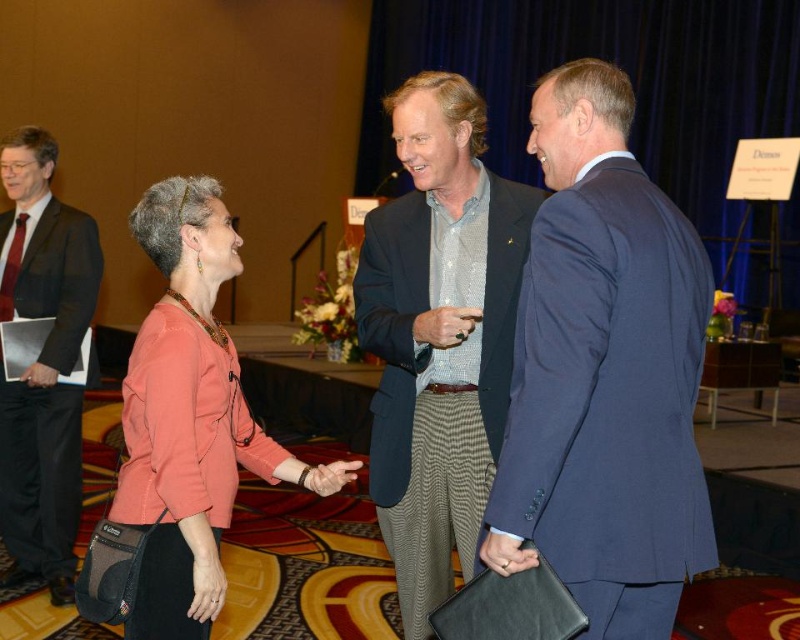
Question: Does matte coral blouse at center lie in front of dark gray suit at left?

Choices:
 (A) no
 (B) yes

Answer: (B)

Question: Which point is farther from the camera taking this photo?

Choices:
 (A) (418, 376)
 (B) (674, 536)

Answer: (A)

Question: Does blue suit at center appear over textured wool blazer at center?

Choices:
 (A) yes
 (B) no

Answer: (A)

Question: Among these objects, which one is farthest from the camera?

Choices:
 (A) blue suit at center
 (B) matte coral blouse at center
 (C) textured wool blazer at center
 (D) dark gray suit at left

Answer: (D)

Question: Can you confirm if textured wool blazer at center is smaller than dark gray suit at left?

Choices:
 (A) yes
 (B) no

Answer: (B)

Question: Among these objects, which one is farthest from the camera?

Choices:
 (A) matte coral blouse at center
 (B) dark gray suit at left
 (C) textured wool blazer at center

Answer: (B)